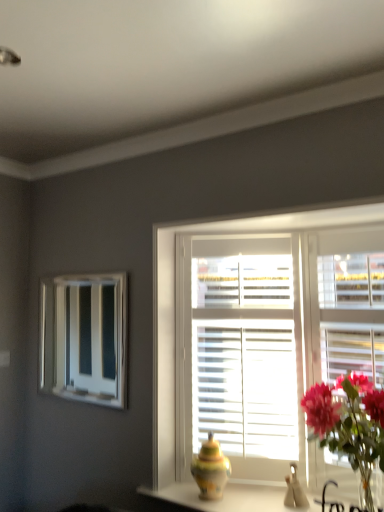
Question: From a real-world perspective, is multicolored ceramic vase at center positioned above or below matte ceramic vase at center?

Choices:
 (A) below
 (B) above

Answer: (B)

Question: In terms of width, does multicolored ceramic vase at center look wider or thinner when compared to matte ceramic vase at center?

Choices:
 (A) thin
 (B) wide

Answer: (A)

Question: Estimate the real-world distances between objects in this image. Which object is farther from the white glossy mirror at upper left?

Choices:
 (A) multicolored ceramic vase at center
 (B) white wooden window at center
 (C) matte ceramic vase at center

Answer: (C)

Question: Which object is positioned closest to the white glossy mirror at upper left?

Choices:
 (A) matte ceramic vase at center
 (B) white wooden window at center
 (C) multicolored ceramic vase at center

Answer: (C)